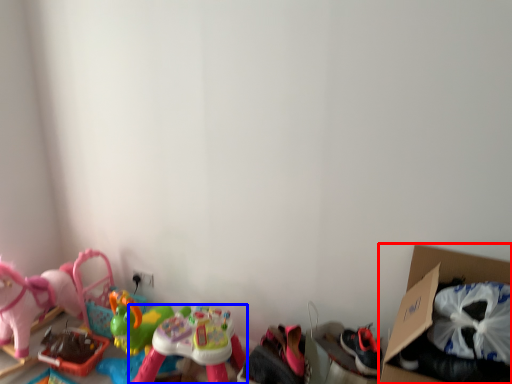
Question: Among these objects, which one is farthest to the camera, cardboard box (highlighted by a red box) or toy (highlighted by a blue box)?

Choices:
 (A) cardboard box
 (B) toy

Answer: (B)